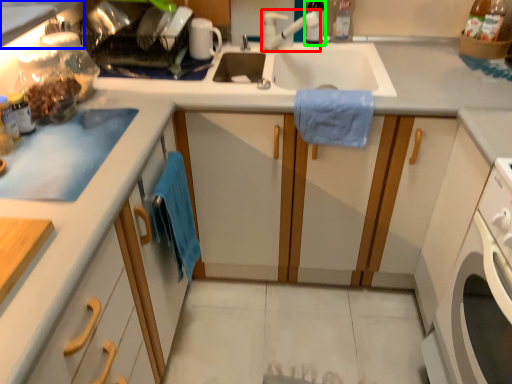
Question: Considering the real-world distances, which object is farthest from faucet (highlighted by a red box)? countertop (highlighted by a blue box) or bottle (highlighted by a green box)?

Choices:
 (A) countertop
 (B) bottle

Answer: (A)